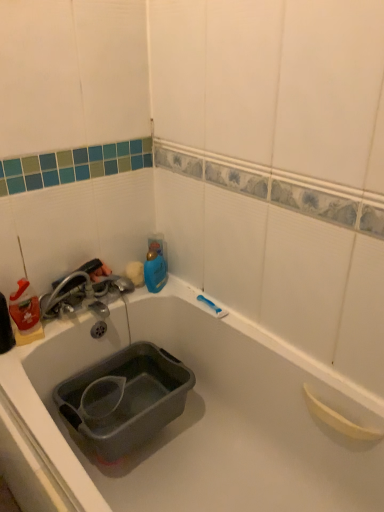
Question: Would you say translucent plastic bottle at left is outside metallic silver faucet at left?

Choices:
 (A) no
 (B) yes

Answer: (B)

Question: Considering the relative positions of translucent plastic bottle at left and metallic silver faucet at left in the image provided, is translucent plastic bottle at left behind metallic silver faucet at left?

Choices:
 (A) no
 (B) yes

Answer: (A)

Question: From the image's perspective, is translucent plastic bottle at left located above metallic silver faucet at left?

Choices:
 (A) yes
 (B) no

Answer: (B)

Question: Does translucent plastic bottle at left have a greater width compared to metallic silver faucet at left?

Choices:
 (A) no
 (B) yes

Answer: (A)

Question: Considering the relative sizes of translucent plastic bottle at left and metallic silver faucet at left in the image provided, is translucent plastic bottle at left smaller than metallic silver faucet at left?

Choices:
 (A) yes
 (B) no

Answer: (A)

Question: Is blue plastic bottle at upper center taller or shorter than metallic silver faucet at left?

Choices:
 (A) short
 (B) tall

Answer: (B)

Question: Is blue plastic bottle at upper center in front of or behind metallic silver faucet at left in the image?

Choices:
 (A) front
 (B) behind

Answer: (B)

Question: From a real-world perspective, is blue plastic bottle at upper center positioned above or below metallic silver faucet at left?

Choices:
 (A) below
 (B) above

Answer: (A)

Question: Visually, is blue plastic bottle at upper center positioned to the left or to the right of metallic silver faucet at left?

Choices:
 (A) left
 (B) right

Answer: (B)

Question: Looking at their shapes, would you say metallic silver faucet at left is wider or thinner than blue plastic bottle at upper center?

Choices:
 (A) wide
 (B) thin

Answer: (A)

Question: Based on their sizes in the image, would you say metallic silver faucet at left is bigger or smaller than blue plastic bottle at upper center?

Choices:
 (A) big
 (B) small

Answer: (A)

Question: Is metallic silver faucet at left spatially inside blue plastic bottle at upper center, or outside of it?

Choices:
 (A) inside
 (B) outside

Answer: (B)

Question: In terms of height, does metallic silver faucet at left look taller or shorter compared to blue plastic bottle at upper center?

Choices:
 (A) tall
 (B) short

Answer: (B)

Question: From a real-world perspective, is metallic silver faucet at left physically located above or below translucent plastic bottle at left?

Choices:
 (A) below
 (B) above

Answer: (A)

Question: Looking at their shapes, would you say metallic silver faucet at left is wider or thinner than translucent plastic bottle at left?

Choices:
 (A) wide
 (B) thin

Answer: (A)